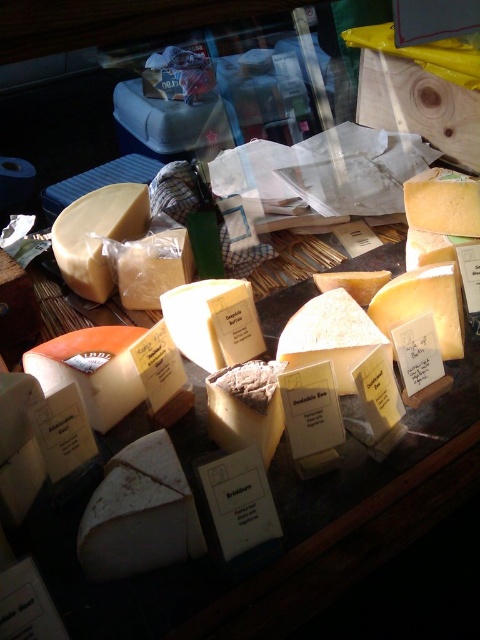
You are a cheese buyer who needs to select a cheese that is positioned higher up on the table. Which cheese should you choose between the matte yellow cheese at center and the golden hard cheese at center?

The matte yellow cheese at center is above the golden hard cheese at center, so you should choose the matte yellow cheese at center as it is positioned higher up on the table.